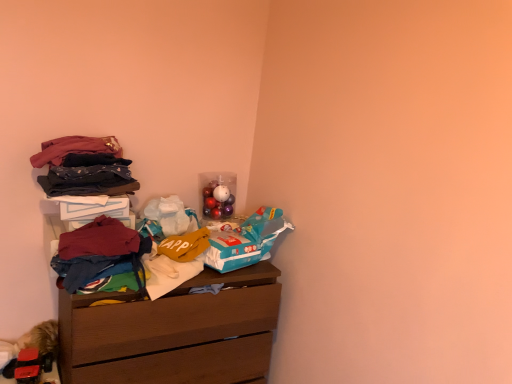
Question: From a real-world perspective, is maroon fabric shirt at left, which is the 3th clothing in top-to-bottom order, positioned under velvet-like fabric at upper left, the fourth clothing ordered from the bottom, based on gravity?

Choices:
 (A) yes
 (B) no

Answer: (A)

Question: Is the position of maroon fabric shirt at left, which is counted as the second clothing, starting from the bottom, less distant than that of velvet-like fabric at upper left, the fourth clothing ordered from the bottom?

Choices:
 (A) yes
 (B) no

Answer: (A)

Question: Is maroon fabric shirt at left, which is the 3th clothing in top-to-bottom order, shorter than velvet-like fabric at upper left, the fourth clothing ordered from the bottom?

Choices:
 (A) no
 (B) yes

Answer: (A)

Question: Is maroon fabric shirt at left, which is counted as the second clothing, starting from the bottom, outside of velvet-like fabric at upper left, the fourth clothing ordered from the bottom?

Choices:
 (A) yes
 (B) no

Answer: (A)

Question: Can velvet-like fabric at upper left, the fourth clothing ordered from the bottom, be found inside maroon fabric shirt at left, which is the 3th clothing in top-to-bottom order?

Choices:
 (A) no
 (B) yes

Answer: (A)

Question: Does maroon fabric shirt at left, which is the 3th clothing in top-to-bottom order, have a larger size compared to velvet-like fabric at upper left, the first clothing in the top-to-bottom sequence?

Choices:
 (A) yes
 (B) no

Answer: (B)

Question: Considering the relative sizes of dark blue cotton pants at left, marked as the third clothing in a bottom-to-top arrangement, and maroon fabric shirt at left, which is counted as the second clothing, starting from the bottom, in the image provided, is dark blue cotton pants at left, marked as the third clothing in a bottom-to-top arrangement, smaller than maroon fabric shirt at left, which is counted as the second clothing, starting from the bottom,?

Choices:
 (A) no
 (B) yes

Answer: (B)

Question: Does dark blue cotton pants at left, marked as the third clothing in a bottom-to-top arrangement, have a larger size compared to maroon fabric shirt at left, which is the 3th clothing in top-to-bottom order?

Choices:
 (A) yes
 (B) no

Answer: (B)

Question: Is dark blue cotton pants at left, marked as the 2th clothing in a top-to-bottom arrangement, next to maroon fabric shirt at left, which is the 3th clothing in top-to-bottom order?

Choices:
 (A) no
 (B) yes

Answer: (A)

Question: Is maroon fabric shirt at left, which is the 3th clothing in top-to-bottom order, a part of dark blue cotton pants at left, marked as the third clothing in a bottom-to-top arrangement?

Choices:
 (A) no
 (B) yes

Answer: (A)

Question: Does dark blue cotton pants at left, marked as the third clothing in a bottom-to-top arrangement, come behind maroon fabric shirt at left, which is the 3th clothing in top-to-bottom order?

Choices:
 (A) no
 (B) yes

Answer: (B)

Question: Considering the relative sizes of dark blue cotton pants at left, marked as the 2th clothing in a top-to-bottom arrangement, and maroon fabric shirt at left, which is the 3th clothing in top-to-bottom order, in the image provided, is dark blue cotton pants at left, marked as the 2th clothing in a top-to-bottom arrangement, wider than maroon fabric shirt at left, which is the 3th clothing in top-to-bottom order,?

Choices:
 (A) yes
 (B) no

Answer: (A)

Question: Can you confirm if wooden chest of drawers at upper left is positioned to the right of maroon fabric shirt at left, which is counted as the second clothing, starting from the bottom?

Choices:
 (A) no
 (B) yes

Answer: (B)